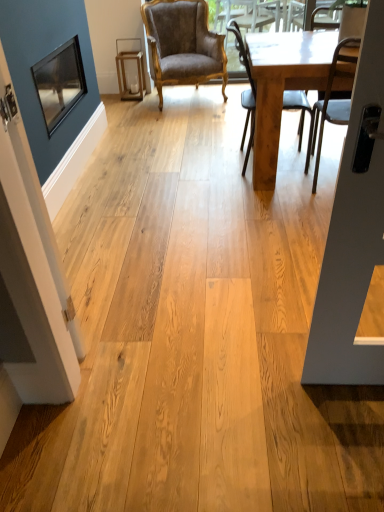
Find the location of a particular element. This screenshot has height=512, width=384. blank space to the left of light brown wooden chair at center, which is the 2th chair in left-to-right order is located at coordinates pyautogui.click(x=199, y=168).